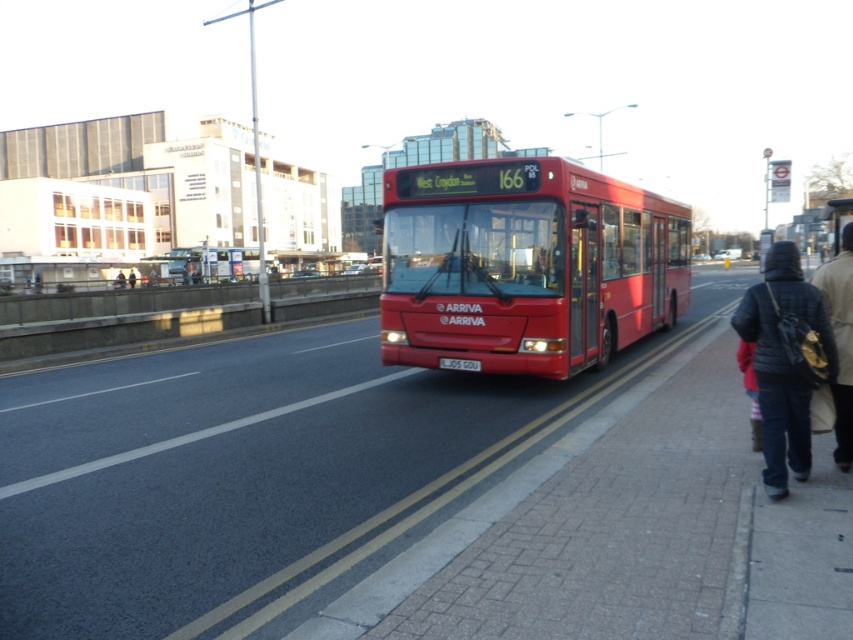
Who is lower down, matte red bus at center or denim jacket at lower right?

matte red bus at center

Between point (625, 186) and point (851, 276), which one is positioned behind?

The point (625, 186) is behind.

This screenshot has width=853, height=640. I want to click on matte red bus at center, so click(525, 266).

Does brick pavement at center have a lesser width compared to dark blue denim jacket at lower right?

Incorrect, brick pavement at center's width is not less than dark blue denim jacket at lower right's.

The width and height of the screenshot is (853, 640). I want to click on brick pavement at center, so click(257, 472).

Between point (224, 348) and point (821, 276), which one is positioned behind?

Positioned behind is point (224, 348).

Is point (202, 460) positioned behind point (848, 300)?

Yes, it is.

Between point (320, 545) and point (842, 304), which one is positioned behind?

Point (842, 304)

The height and width of the screenshot is (640, 853). What are the coordinates of `brick pavement at center` in the screenshot? It's located at (257, 472).